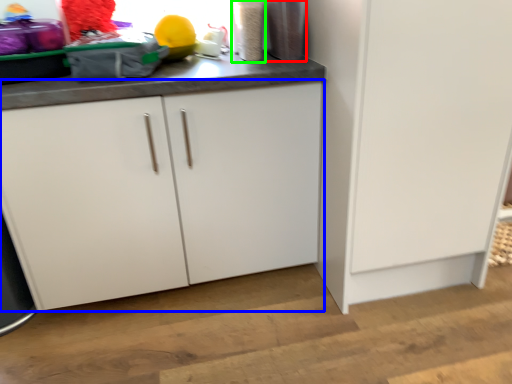
Question: Which object is positioned closest to appliance (highlighted by a red box)? Select from cabinetry (highlighted by a blue box) and appliance (highlighted by a green box).

Choices:
 (A) cabinetry
 (B) appliance

Answer: (B)